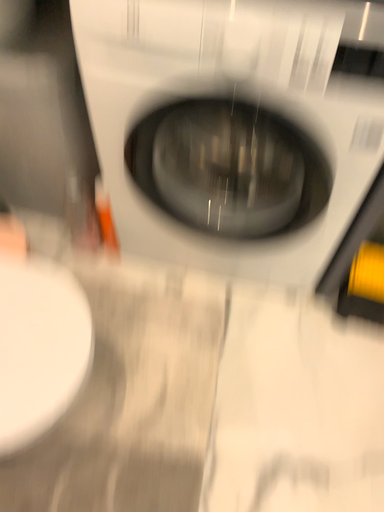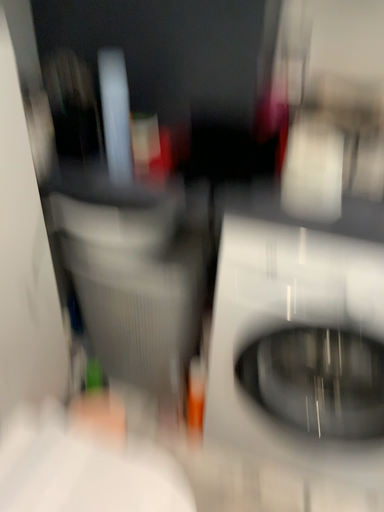
Question: Which way did the camera rotate in the video?

Choices:
 (A) rotated upward
 (B) rotated downward

Answer: (A)